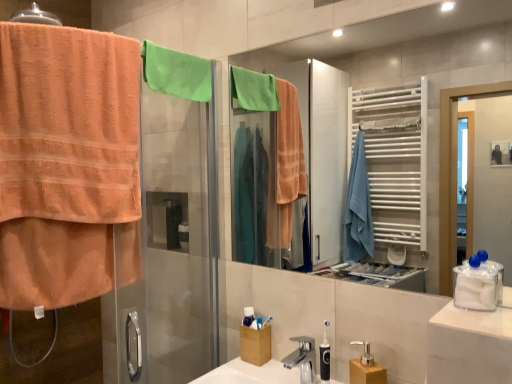
Question: Is green cotton towel at upper center taller than white plastic toothbrush at center, arranged as the first toiletry when viewed from the left?

Choices:
 (A) no
 (B) yes

Answer: (B)

Question: Does green cotton towel at upper center have a smaller size compared to white plastic toothbrush at center, positioned as the 1th toiletry in back-to-front order?

Choices:
 (A) yes
 (B) no

Answer: (B)

Question: Is green cotton towel at upper center located outside white plastic toothbrush at center, which is the 2th toiletry in front-to-back order?

Choices:
 (A) yes
 (B) no

Answer: (A)

Question: Is green cotton towel at upper center turned away from white plastic toothbrush at center, which is the 2th toiletry in front-to-back order?

Choices:
 (A) yes
 (B) no

Answer: (B)

Question: Considering the relative positions of green cotton towel at upper center and white plastic toothbrush at center, positioned as the 1th toiletry in back-to-front order, in the image provided, is green cotton towel at upper center to the left of white plastic toothbrush at center, positioned as the 1th toiletry in back-to-front order, from the viewer's perspective?

Choices:
 (A) yes
 (B) no

Answer: (A)

Question: Does green cotton towel at upper center have a lesser height compared to white plastic toothbrush at center, the second toiletry positioned from the right?

Choices:
 (A) no
 (B) yes

Answer: (A)

Question: Does white plastic toothbrush at center, the second toiletry positioned from the right, appear on the left side of matte glass mirror at center?

Choices:
 (A) yes
 (B) no

Answer: (A)

Question: Can you confirm if white plastic toothbrush at center, the second toiletry positioned from the right, is smaller than matte glass mirror at center?

Choices:
 (A) no
 (B) yes

Answer: (B)

Question: Does white plastic toothbrush at center, which is the 2th toiletry in front-to-back order, have a greater width compared to matte glass mirror at center?

Choices:
 (A) no
 (B) yes

Answer: (B)

Question: Is white plastic toothbrush at center, the second toiletry positioned from the right, turned away from matte glass mirror at center?

Choices:
 (A) no
 (B) yes

Answer: (A)

Question: Is white plastic toothbrush at center, arranged as the first toiletry when viewed from the left, placed right next to matte glass mirror at center?

Choices:
 (A) no
 (B) yes

Answer: (A)

Question: Considering the relative sizes of white plastic toothbrush at center, the second toiletry positioned from the right, and matte glass mirror at center in the image provided, is white plastic toothbrush at center, the second toiletry positioned from the right, taller than matte glass mirror at center?

Choices:
 (A) no
 (B) yes

Answer: (A)

Question: Is matte glass mirror at center further to camera compared to orange terry cloth towel at left?

Choices:
 (A) yes
 (B) no

Answer: (B)